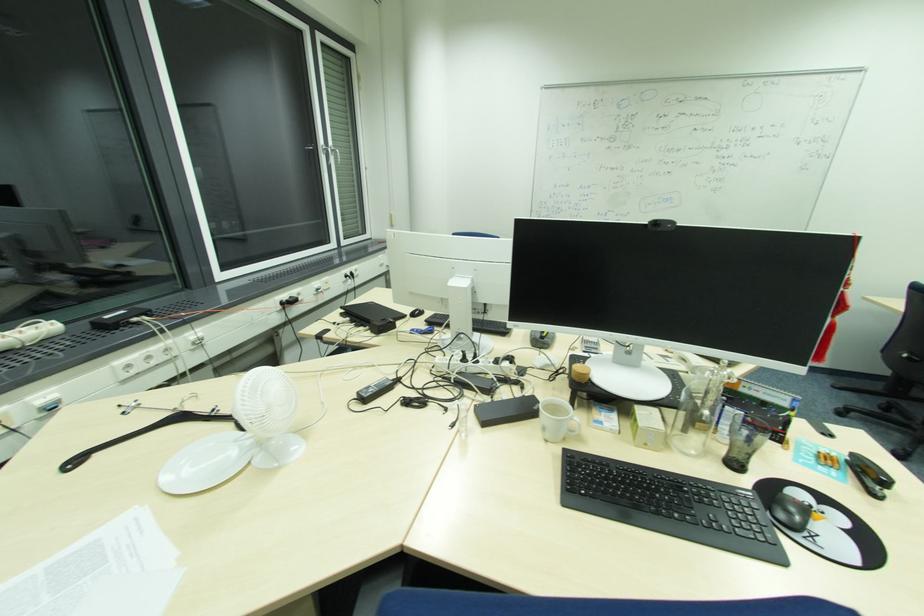
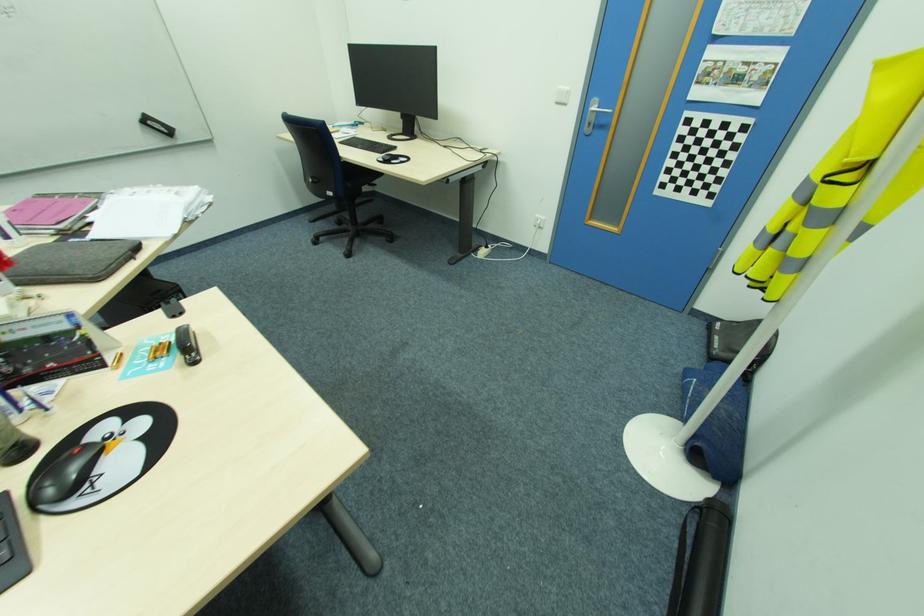
Locate, in the second image, the point that corresponds to point 833,450 in the first image.

(174, 334)